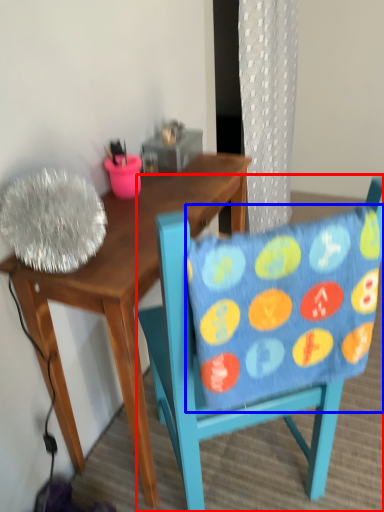
Question: Which object is further to the camera taking this photo, chair (highlighted by a red box) or pillow (highlighted by a blue box)?

Choices:
 (A) chair
 (B) pillow

Answer: (A)